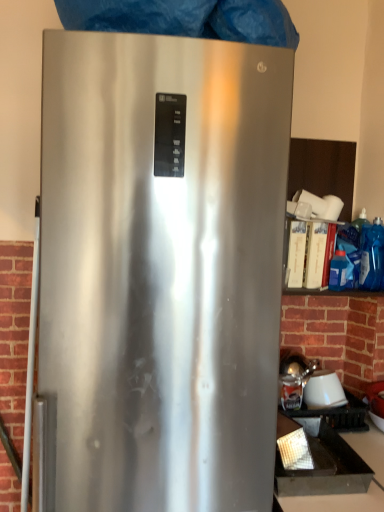
Question: From a real-world perspective, does blue plastic bag at right stand above brickwork at left?

Choices:
 (A) yes
 (B) no

Answer: (A)

Question: Is brickwork at left at the back of blue plastic bag at right?

Choices:
 (A) no
 (B) yes

Answer: (A)

Question: Does blue plastic bag at right have a greater height compared to brickwork at left?

Choices:
 (A) yes
 (B) no

Answer: (B)

Question: Is blue plastic bag at right not within brickwork at left?

Choices:
 (A) yes
 (B) no

Answer: (A)

Question: Does blue plastic bag at right appear on the right side of brickwork at left?

Choices:
 (A) no
 (B) yes

Answer: (B)

Question: From a real-world perspective, is black matte tray at lower right physically located above or below satin silver refrigerator at center?

Choices:
 (A) below
 (B) above

Answer: (A)

Question: Is black matte tray at lower right taller or shorter than satin silver refrigerator at center?

Choices:
 (A) short
 (B) tall

Answer: (A)

Question: Is black matte tray at lower right to the left or to the right of satin silver refrigerator at center in the image?

Choices:
 (A) right
 (B) left

Answer: (A)

Question: Relative to satin silver refrigerator at center, is black matte tray at lower right in front or behind?

Choices:
 (A) front
 (B) behind

Answer: (B)

Question: Is blue plastic bag at right inside the boundaries of satin silver refrigerator at center, or outside?

Choices:
 (A) outside
 (B) inside

Answer: (A)

Question: From the image's perspective, is blue plastic bag at right positioned above or below satin silver refrigerator at center?

Choices:
 (A) below
 (B) above

Answer: (B)

Question: Does point (304, 222) appear closer or farther from the camera than point (114, 266)?

Choices:
 (A) closer
 (B) farther

Answer: (B)

Question: Is blue plastic bag at right bigger or smaller than satin silver refrigerator at center?

Choices:
 (A) small
 (B) big

Answer: (A)

Question: Is brickwork at left wider or thinner than satin silver refrigerator at center?

Choices:
 (A) wide
 (B) thin

Answer: (B)

Question: From a real-world perspective, is brickwork at left positioned above or below satin silver refrigerator at center?

Choices:
 (A) above
 (B) below

Answer: (B)